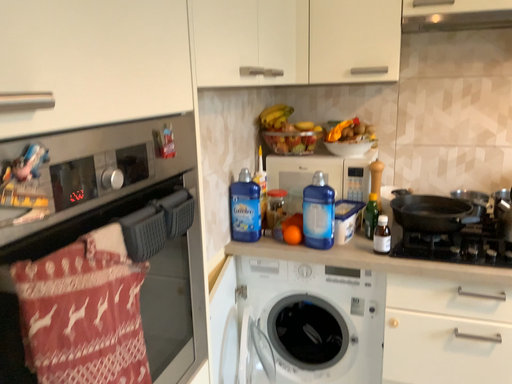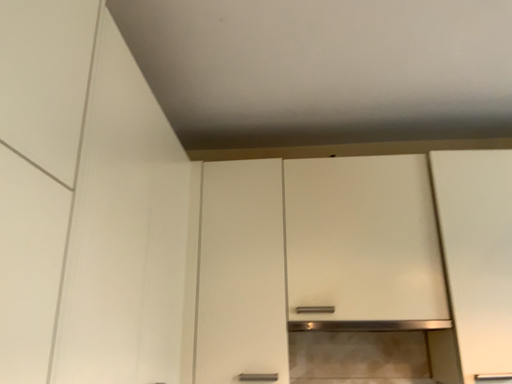
Question: How did the camera likely rotate when shooting the video?

Choices:
 (A) rotated right
 (B) rotated left

Answer: (A)